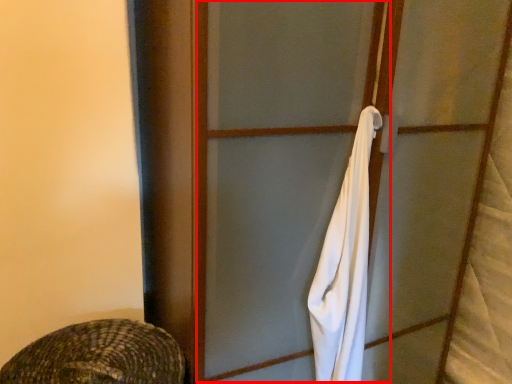
Question: From the image's perspective, what is the correct spatial positioning of screen door (annotated by the red box) in reference to towel/napkin?

Choices:
 (A) below
 (B) above

Answer: (A)